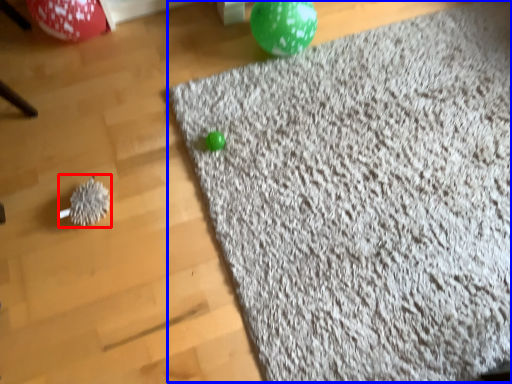
Question: Which point is further to the camera, toy (highlighted by a red box) or mat (highlighted by a blue box)?

Choices:
 (A) toy
 (B) mat

Answer: (A)